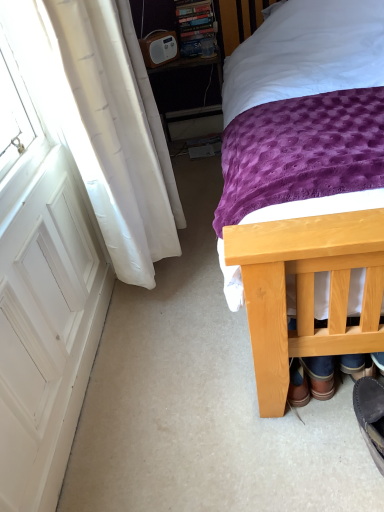
Question: Would you say white plastic radio at upper center is to the left or to the right of white matte screen door at left in the picture?

Choices:
 (A) left
 (B) right

Answer: (B)

Question: From the image's perspective, is white plastic radio at upper center positioned above or below white matte screen door at left?

Choices:
 (A) below
 (B) above

Answer: (B)

Question: Considering the real-world distances, which object is closest to the white plastic radio at upper center?

Choices:
 (A) dark grey suede shoe at lower right, placed as the 1th footwear when sorted from right to left
 (B) brown leather boots at lower right, marked as the first footwear in a left-to-right arrangement
 (C) white matte screen door at left
 (D) wooden bed at center

Answer: (D)

Question: Considering the real-world distances, which object is farthest from the white matte screen door at left?

Choices:
 (A) dark grey suede shoe at lower right, which is the first footwear from front to back
 (B) white plastic radio at upper center
 (C) brown leather boots at lower right, marked as the first footwear in a left-to-right arrangement
 (D) wooden bed at center

Answer: (B)